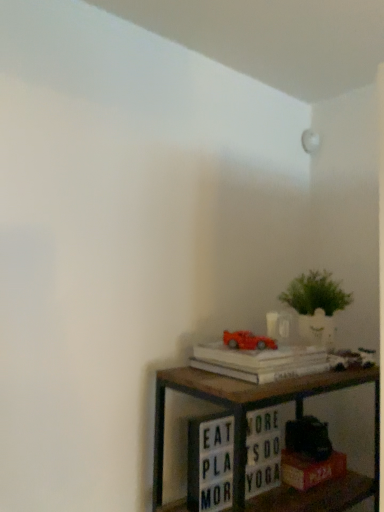
Question: From the image's perspective, is hardcover book at lower right, placed as the 1th paperback book when sorted from bottom to top, below green leafy plant in white pot at lower right?

Choices:
 (A) yes
 (B) no

Answer: (A)

Question: Can you confirm if hardcover book at lower right, placed as the 1th paperback book when sorted from bottom to top, is taller than green leafy plant in white pot at lower right?

Choices:
 (A) no
 (B) yes

Answer: (A)

Question: Is hardcover book at lower right, the second paperback book positioned from the top, to the left of green leafy plant in white pot at lower right from the viewer's perspective?

Choices:
 (A) yes
 (B) no

Answer: (A)

Question: Considering the relative positions of hardcover book at lower right, the second paperback book positioned from the top, and green leafy plant in white pot at lower right in the image provided, is hardcover book at lower right, the second paperback book positioned from the top, in front of green leafy plant in white pot at lower right?

Choices:
 (A) no
 (B) yes

Answer: (B)

Question: Is green leafy plant in white pot at lower right surrounded by hardcover book at lower right, placed as the 1th paperback book when sorted from bottom to top?

Choices:
 (A) yes
 (B) no

Answer: (B)

Question: Is hardcover book at lower right, placed as the 1th paperback book when sorted from bottom to top, to the right of green leafy plant in white pot at lower right from the viewer's perspective?

Choices:
 (A) yes
 (B) no

Answer: (B)

Question: Is white paper at upper right, arranged as the first paperback book when viewed from the top, behind wooden shelf at lower right?

Choices:
 (A) no
 (B) yes

Answer: (B)

Question: Is white paper at upper right, positioned as the 2th paperback book in bottom-to-top order, surrounding wooden shelf at lower right?

Choices:
 (A) no
 (B) yes

Answer: (A)

Question: Is white paper at upper right, arranged as the first paperback book when viewed from the top, at the right side of wooden shelf at lower right?

Choices:
 (A) yes
 (B) no

Answer: (B)

Question: Considering the relative positions of white paper at upper right, positioned as the 2th paperback book in bottom-to-top order, and wooden shelf at lower right in the image provided, is white paper at upper right, positioned as the 2th paperback book in bottom-to-top order, in front of wooden shelf at lower right?

Choices:
 (A) no
 (B) yes

Answer: (A)

Question: Does white paper at upper right, positioned as the 2th paperback book in bottom-to-top order, have a lesser width compared to wooden shelf at lower right?

Choices:
 (A) no
 (B) yes

Answer: (B)

Question: Is white paper at upper right, arranged as the first paperback book when viewed from the top, aimed at wooden shelf at lower right?

Choices:
 (A) no
 (B) yes

Answer: (A)

Question: Could hardcover book at lower right, the second paperback book positioned from the top, be considered to be inside wooden shelf at lower right?

Choices:
 (A) yes
 (B) no

Answer: (A)